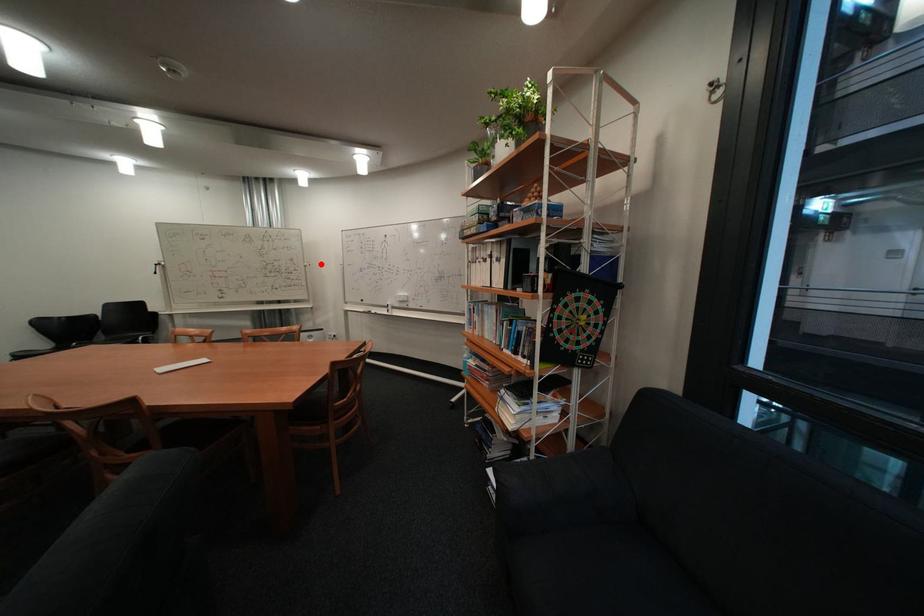
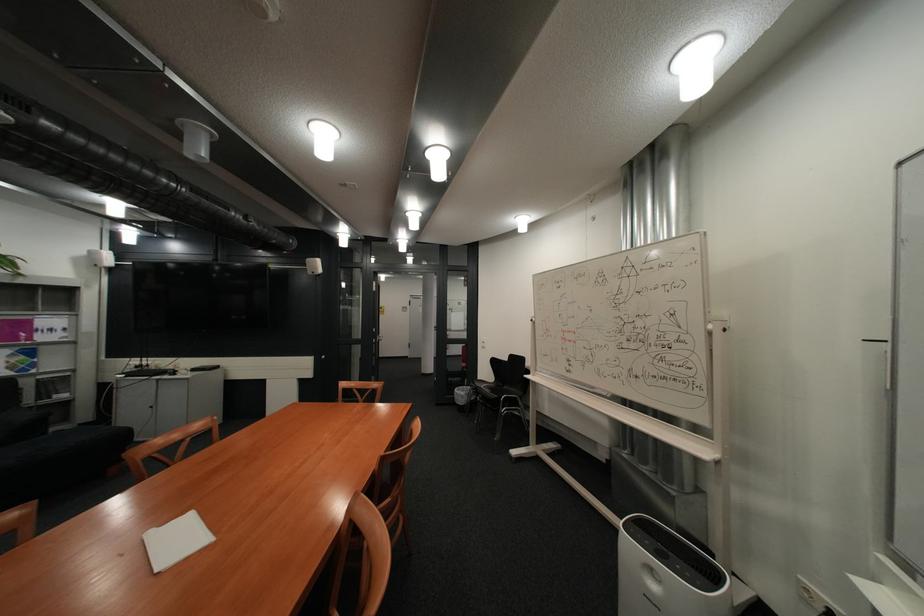
In the second image, find the point that corresponds to the highlighted location in the first image.

(725, 326)